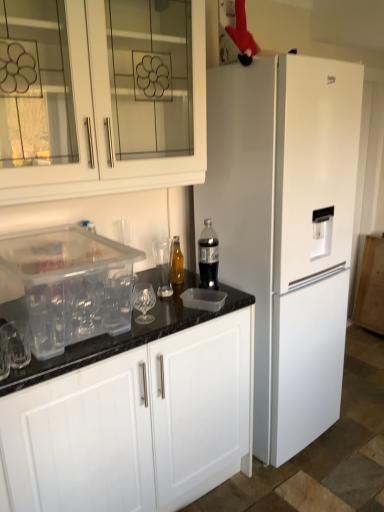
Measure the distance between point (110, 245) and camera.

The distance of point (110, 245) from camera is 1.69 meters.

The image size is (384, 512). What are the coordinates of `white matte refrigerator at right` in the screenshot? It's located at (286, 229).

Describe the element at coordinates (208, 257) in the screenshot. I see `translucent plastic bottle at center, arranged as the 1th bottle when viewed from the right` at that location.

You are a GUI agent. You are given a task and a screenshot of the screen. Output one action in this format:
    pyautogui.click(x=<x>, y=<y>)
    Task: Click on the translucent glass bottle at center, arranged as the first bottle when viewed from the back
    The image size is (384, 512).
    Given the screenshot: What is the action you would take?
    pyautogui.click(x=176, y=262)

Considering the relative sizes of translucent glass bottle at center, arranged as the first bottle when viewed from the back, and translucent plastic bottle at center, arranged as the 1th bottle when viewed from the right, in the image provided, is translucent glass bottle at center, arranged as the first bottle when viewed from the back, bigger than translucent plastic bottle at center, arranged as the 1th bottle when viewed from the right,?

No, translucent glass bottle at center, arranged as the first bottle when viewed from the back, is not bigger than translucent plastic bottle at center, arranged as the 1th bottle when viewed from the right.

This screenshot has height=512, width=384. I want to click on bottle above the translucent glass bottle at center, arranged as the first bottle when viewed from the back (from the image's perspective), so click(208, 257).

Between point (175, 283) and point (202, 266), which one is positioned in front?

Positioned in front is point (202, 266).

Is translucent glass bottle at center, marked as the first bottle in a left-to-right arrangement, situated inside white glass cabinet at upper left, which is counted as the 2th cabinetry, starting from the bottom, or outside?

translucent glass bottle at center, marked as the first bottle in a left-to-right arrangement, is spatially situated outside white glass cabinet at upper left, which is counted as the 2th cabinetry, starting from the bottom.

From the image's perspective, relative to white glass cabinet at upper left, which is counted as the 2th cabinetry, starting from the bottom, is translucent glass bottle at center, arranged as the first bottle when viewed from the back, above or below?

translucent glass bottle at center, arranged as the first bottle when viewed from the back, is below white glass cabinet at upper left, which is counted as the 2th cabinetry, starting from the bottom.

From a real-world perspective, who is located lower, translucent glass bottle at center, arranged as the first bottle when viewed from the back, or white glass cabinet at upper left, arranged as the first cabinetry when viewed from the top?

From a 3D spatial view, translucent glass bottle at center, arranged as the first bottle when viewed from the back, is below.

From a real-world perspective, which is physically below, translucent plastic bottle at center, arranged as the 2th bottle when viewed from the left, or translucent glass bottle at center, the second bottle in the front-to-back sequence?

translucent glass bottle at center, the second bottle in the front-to-back sequence.

Is translucent plastic bottle at center, arranged as the 2th bottle when viewed from the left, beside translucent glass bottle at center, the second bottle from the right?

No, translucent plastic bottle at center, arranged as the 2th bottle when viewed from the left, is not making contact with translucent glass bottle at center, the second bottle from the right.

Is translucent plastic bottle at center, arranged as the 2th bottle when viewed from the left, facing away from translucent glass bottle at center, the second bottle in the front-to-back sequence?

That's right, translucent plastic bottle at center, arranged as the 2th bottle when viewed from the left, is facing away from translucent glass bottle at center, the second bottle in the front-to-back sequence.

Considering the positions of points (215, 262) and (174, 266), is point (215, 262) farther from camera compared to point (174, 266)?

No, (215, 262) is in front of (174, 266).

From a real-world perspective, is white glass cabinet at upper left, arranged as the first cabinetry when viewed from the top, over translucent glass bottle at center, arranged as the first bottle when viewed from the back?

Yes, from a real-world perspective, white glass cabinet at upper left, arranged as the first cabinetry when viewed from the top, is over translucent glass bottle at center, arranged as the first bottle when viewed from the back

Is white glass cabinet at upper left, which is counted as the 2th cabinetry, starting from the bottom, outside of translucent glass bottle at center, the second bottle from the right?

white glass cabinet at upper left, which is counted as the 2th cabinetry, starting from the bottom, is positioned outside translucent glass bottle at center, the second bottle from the right.

I want to click on cabinetry that is the 2nd one when counting leftward from the translucent glass bottle at center, arranged as the first bottle when viewed from the back, so pyautogui.click(x=111, y=123).

From the image's perspective, is white glass cabinet at upper left, which is counted as the 2th cabinetry, starting from the bottom, located beneath translucent glass bottle at center, marked as the first bottle in a left-to-right arrangement?

No.

In the scene shown: Which point is more distant from viewer, (247,199) or (153,164)?

The point (247,199) is farther from the camera.

Consider the image. From a real-world perspective, is white matte refrigerator at right located higher than white glass cabinet at upper left, arranged as the first cabinetry when viewed from the top?

No, from a real-world perspective, white matte refrigerator at right is not over white glass cabinet at upper left, arranged as the first cabinetry when viewed from the top

The width and height of the screenshot is (384, 512). In the image, there is a white glass cabinet at upper left, arranged as the first cabinetry when viewed from the top. In order to click on refrigerator below it (from the image's perspective) in this screenshot , I will do `click(286, 229)`.

Is white matte refrigerator at right spatially inside white glass cabinet at upper left, which is counted as the 2th cabinetry, starting from the bottom, or outside of it?

white matte refrigerator at right lies outside white glass cabinet at upper left, which is counted as the 2th cabinetry, starting from the bottom.

Is white matte refrigerator at right turned away from transparent plastic container at lower left?

That's not correct — white matte refrigerator at right is not looking away from transparent plastic container at lower left.

Do you think white matte refrigerator at right is within transparent plastic container at lower left, or outside of it?

white matte refrigerator at right is not inside transparent plastic container at lower left, it's outside.

From a real-world perspective, who is located lower, white matte refrigerator at right or transparent plastic container at lower left?

white matte refrigerator at right.

Considering the sizes of objects white matte refrigerator at right and transparent plastic container at lower left in the image provided, who is thinner, white matte refrigerator at right or transparent plastic container at lower left?

transparent plastic container at lower left.

There is a transparent plastic container at lower left. Where is `bottle above it (from a real-world perspective)`? bottle above it (from a real-world perspective) is located at coordinates (208, 257).

Is translucent plastic bottle at center, arranged as the 1th bottle when viewed from the right, smaller than transparent plastic container at lower left?

Yes, translucent plastic bottle at center, arranged as the 1th bottle when viewed from the right, is smaller than transparent plastic container at lower left.

From the picture: Is translucent plastic bottle at center, arranged as the 2th bottle when viewed from the left, not within transparent plastic container at lower left?

Yes, translucent plastic bottle at center, arranged as the 2th bottle when viewed from the left, is located beyond the bounds of transparent plastic container at lower left.

Is translucent plastic bottle at center, arranged as the 2th bottle when viewed from the left, facing away from transparent plastic container at lower left?

translucent plastic bottle at center, arranged as the 2th bottle when viewed from the left, is not turned away from transparent plastic container at lower left.

You are a GUI agent. You are given a task and a screenshot of the screen. Output one action in this format:
    pyautogui.click(x=<x>, y=<y>)
    Task: Click on the bottle that is on the right side of translucent glass bottle at center, marked as the first bottle in a left-to-right arrangement
    This screenshot has width=384, height=512.
    Given the screenshot: What is the action you would take?
    pyautogui.click(x=208, y=257)

You are a GUI agent. You are given a task and a screenshot of the screen. Output one action in this format:
    pyautogui.click(x=<x>, y=<y>)
    Task: Click on the 2nd cabinetry to the left when counting from the translucent glass bottle at center, marked as the first bottle in a left-to-right arrangement
    
    Given the screenshot: What is the action you would take?
    pyautogui.click(x=111, y=123)

From the image, which object appears to be farther from clear plastic container at lower left, the 2th cabinetry when ordered from top to bottom, white matte refrigerator at right or transparent plastic container at lower left?

white matte refrigerator at right lies further to clear plastic container at lower left, the 2th cabinetry when ordered from top to bottom, than the other object.

Based on their spatial positions, is white matte refrigerator at right or white glass cabinet at upper left, arranged as the first cabinetry when viewed from the top, further from transparent plastic container at lower left?

Based on the image, white matte refrigerator at right appears to be further to transparent plastic container at lower left.

Looking at the image, which one is located closer to clear plastic container at lower left, the 2th cabinetry when ordered from top to bottom, translucent plastic bottle at center, arranged as the 2th bottle when viewed from the left, or transparent plastic container at lower left?

The object closer to clear plastic container at lower left, the 2th cabinetry when ordered from top to bottom, is transparent plastic container at lower left.

Considering their positions, is white glass cabinet at upper left, arranged as the first cabinetry when viewed from the top, positioned closer to transparent plastic container at lower left than white matte refrigerator at right?

Among the two, white glass cabinet at upper left, arranged as the first cabinetry when viewed from the top, is located nearer to transparent plastic container at lower left.

Which object lies nearer to the anchor point white matte refrigerator at right, transparent plastic container at lower left or clear plastic container at lower left, the 2th cabinetry when ordered from top to bottom?

clear plastic container at lower left, the 2th cabinetry when ordered from top to bottom, is positioned closer to the anchor white matte refrigerator at right.

When comparing their distances from white matte refrigerator at right, does translucent plastic bottle at center, arranged as the 2th bottle when viewed from the left, or white glass cabinet at upper left, which is counted as the 2th cabinetry, starting from the bottom, seem further?

The object further to white matte refrigerator at right is white glass cabinet at upper left, which is counted as the 2th cabinetry, starting from the bottom.

From the image, which object appears to be nearer to translucent plastic bottle at center, arranged as the 2th bottle when viewed from the left, white glass cabinet at upper left, arranged as the first cabinetry when viewed from the top, or transparent plastic container at lower left?

transparent plastic container at lower left lies closer to translucent plastic bottle at center, arranged as the 2th bottle when viewed from the left, than the other object.

In the scene shown: Based on their spatial positions, is transparent plastic container at lower left or translucent plastic bottle at center, which is the 2th bottle from back to front, closer to white glass cabinet at upper left, arranged as the first cabinetry when viewed from the top?

Based on the image, transparent plastic container at lower left appears to be nearer to white glass cabinet at upper left, arranged as the first cabinetry when viewed from the top.

Find the location of a particular element. appliance between translucent plastic bottle at center, arranged as the 1th bottle when viewed from the right, and clear plastic container at lower left, the 1th cabinetry ordered from the bottom, vertically is located at coordinates (70, 285).

You are a GUI agent. You are given a task and a screenshot of the screen. Output one action in this format:
    pyautogui.click(x=<x>, y=<y>)
    Task: Click on the refrigerator between white glass cabinet at upper left, which is counted as the 2th cabinetry, starting from the bottom, and clear plastic container at lower left, the 2th cabinetry when ordered from top to bottom, vertically
    
    Given the screenshot: What is the action you would take?
    pyautogui.click(x=286, y=229)

You are a GUI agent. You are given a task and a screenshot of the screen. Output one action in this format:
    pyautogui.click(x=<x>, y=<y>)
    Task: Click on the appliance between white glass cabinet at upper left, arranged as the first cabinetry when viewed from the top, and translucent glass bottle at center, the second bottle in the front-to-back sequence, from front to back
    
    Given the screenshot: What is the action you would take?
    pyautogui.click(x=70, y=285)

Find the location of a particular element. Image resolution: width=384 pixels, height=512 pixels. bottle located between translucent glass bottle at center, the second bottle in the front-to-back sequence, and white matte refrigerator at right in the left-right direction is located at coordinates (208, 257).